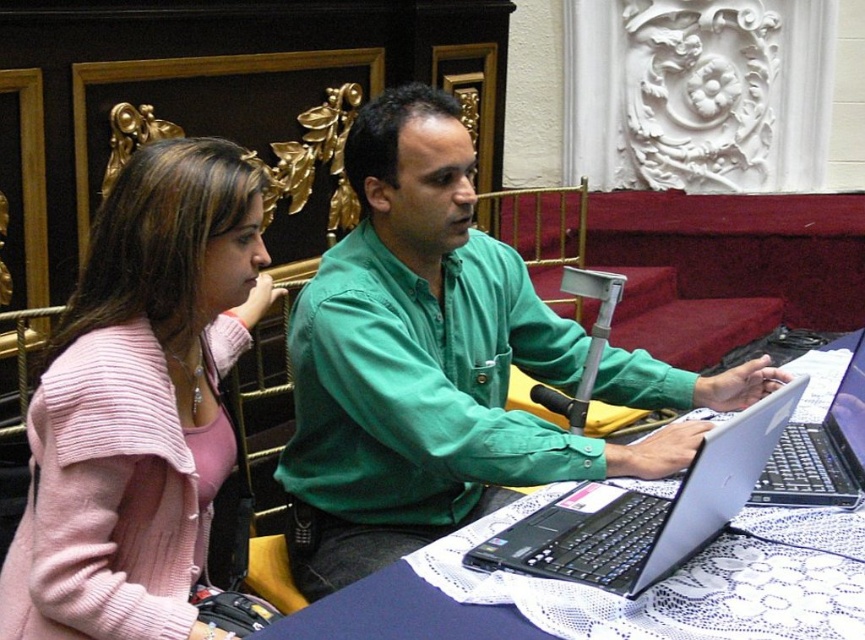
Question: Which point is closer to the camera?

Choices:
 (A) (753, 634)
 (B) (591, 508)
 (C) (860, 492)
 (D) (189, 200)

Answer: (A)

Question: Does pink knitted sweater at upper left appear under black matte laptop at center?

Choices:
 (A) no
 (B) yes

Answer: (A)

Question: Which point appears farthest from the camera in this image?

Choices:
 (A) (136, 618)
 (B) (651, 445)
 (C) (575, 568)
 (D) (798, 445)

Answer: (D)

Question: Which point is closer to the camera?

Choices:
 (A) (367, 611)
 (B) (862, 476)

Answer: (A)

Question: Does green matte shirt at center have a lesser width compared to black matte laptop at center?

Choices:
 (A) yes
 (B) no

Answer: (B)

Question: From the image, what is the correct spatial relationship of green matte shirt at center in relation to black matte laptop at center?

Choices:
 (A) left
 (B) right

Answer: (A)